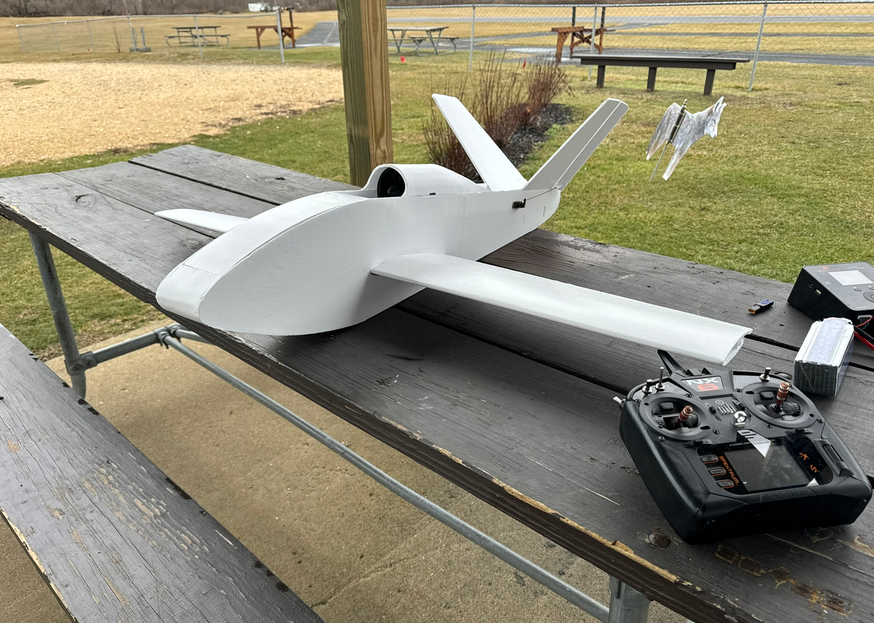
Find the location of a particular element. concrete under table is located at coordinates (344, 579).